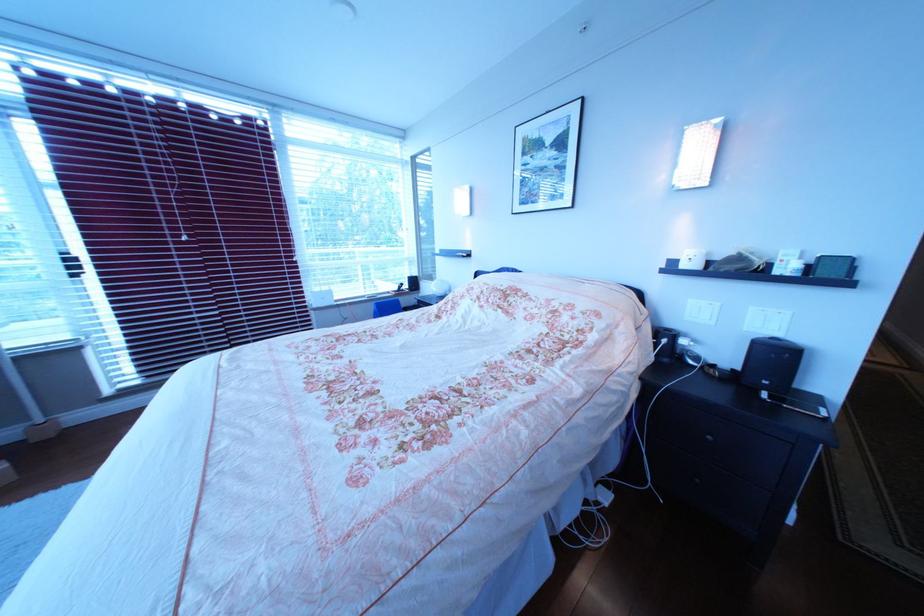
The width and height of the screenshot is (924, 616). In order to click on chair sitting surface in this screenshot , I will do `click(386, 307)`.